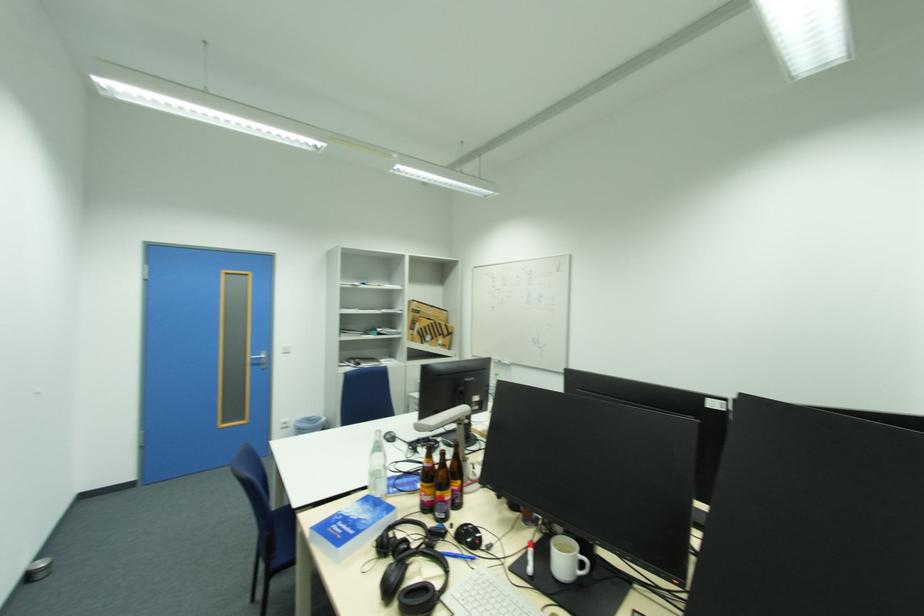
What do you see at coordinates (259, 360) in the screenshot? I see `a silver door handle` at bounding box center [259, 360].